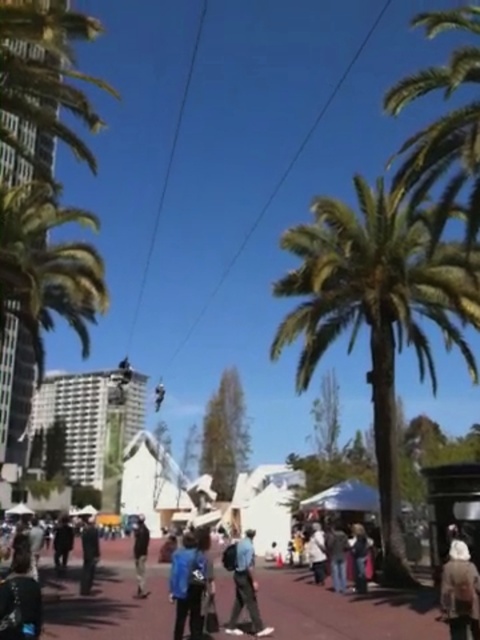
Question: Can you confirm if green leafy palm tree at center is positioned above white woolen hat at lower right?

Choices:
 (A) yes
 (B) no

Answer: (A)

Question: Considering the real-world distances, which object is farthest from the dark blue jeans at center?

Choices:
 (A) dark blue jacket at center
 (B) white woolen hat at lower right
 (C) dark blue jacket at lower center

Answer: (B)

Question: Is dark blue jeans at center below dark gray jacket at lower left?

Choices:
 (A) no
 (B) yes

Answer: (B)

Question: Where is paved asphalt at center located in relation to dark blue jacket at lower left in the image?

Choices:
 (A) left
 (B) right

Answer: (B)

Question: Which of the following is the closest to the observer?

Choices:
 (A) (178, 588)
 (B) (425, 356)
 (C) (95, 532)

Answer: (A)

Question: Among these objects, which one is farthest from the camera?

Choices:
 (A) dark blue jeans at center
 (B) white woolen hat at lower right
 (C) dark blue jacket at lower left

Answer: (A)